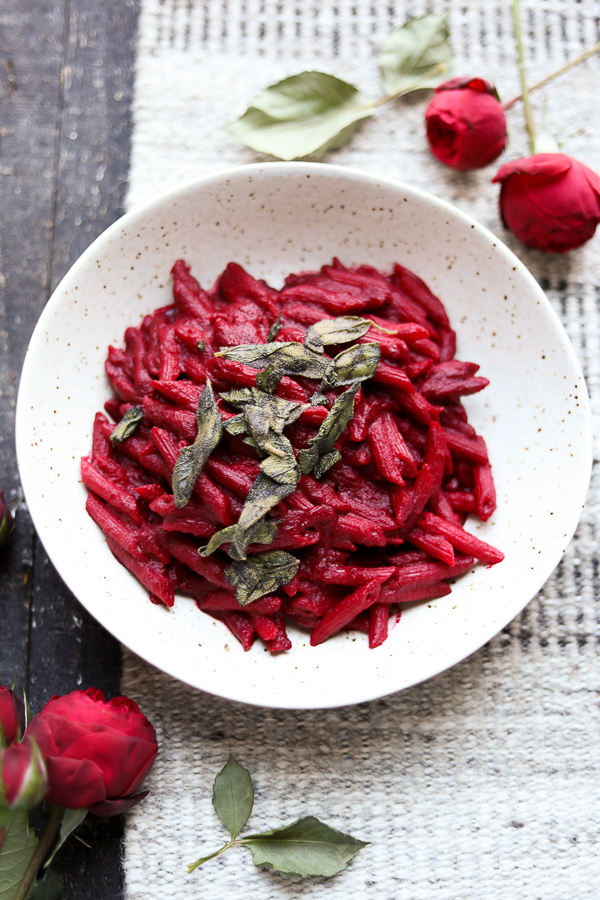
Identify the location of place mat. This screenshot has width=600, height=900. (520, 731).